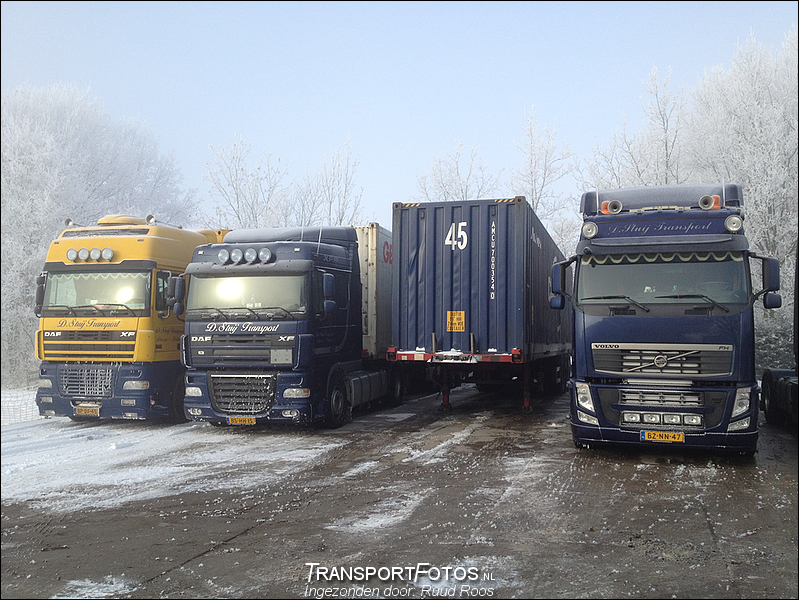
In order to click on lights in this screenshot , I will do click(88, 253).